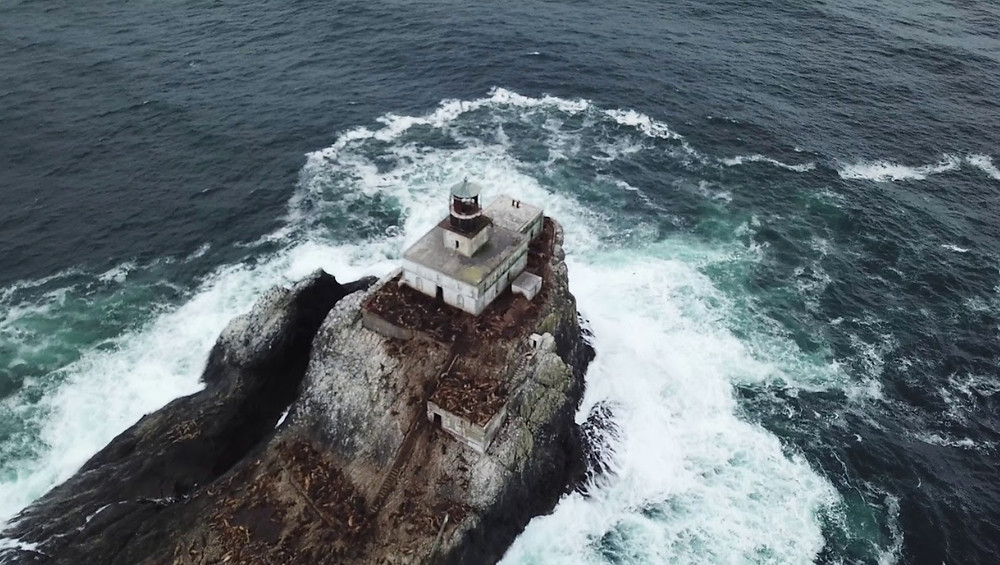
You are a GUI agent. You are given a task and a screenshot of the screen. Output one action in this format:
    pyautogui.click(x=<x>, y=<y>)
    Task: Click on the doorway
    
    Given the screenshot: What is the action you would take?
    pyautogui.click(x=437, y=419), pyautogui.click(x=533, y=341), pyautogui.click(x=435, y=291)